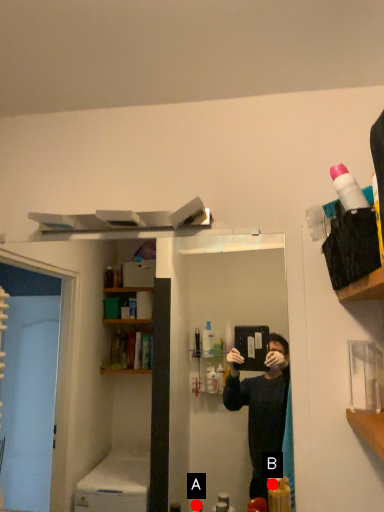
Question: Two points are circled on the image, labeled by A and B beside each circle. Which point appears closest to the camera in this image?

Choices:
 (A) A is closer
 (B) B is closer

Answer: (B)